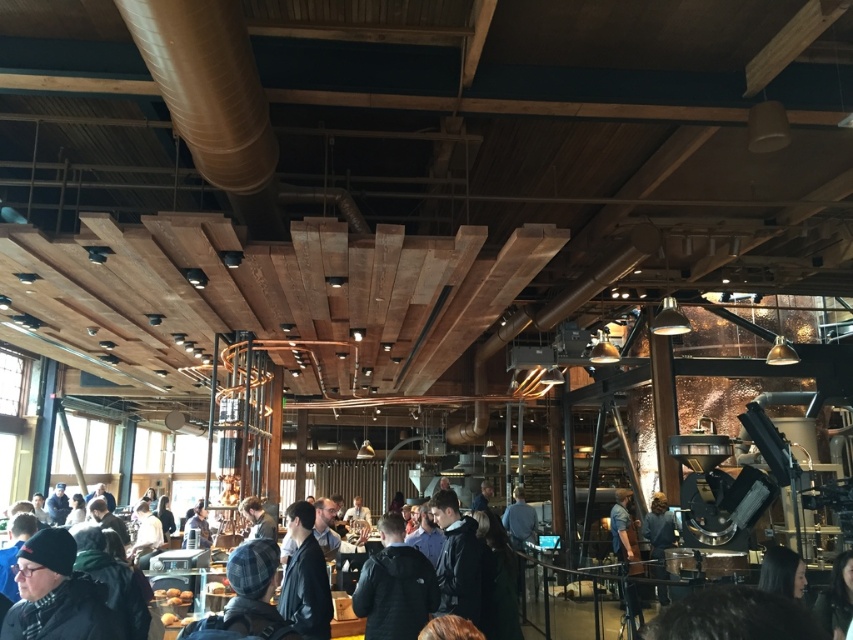
Image resolution: width=853 pixels, height=640 pixels. What do you see at coordinates (393, 586) in the screenshot?
I see `dark blue jacket at center` at bounding box center [393, 586].

How much distance is there between dark blue jacket at center and blue shirt at center?

dark blue jacket at center is 6.52 meters from blue shirt at center.

Based on the photo, who is more distant from viewer, (351, 602) or (627, 538)?

Point (627, 538)

Identify the location of dark blue jacket at center. (393, 586).

I want to click on smooth black hair at lower right, so click(x=782, y=572).

Is smooth black hair at lower right further to the viewer compared to blue shirt at center?

No, smooth black hair at lower right is closer to the viewer.

Who is more forward, (785, 570) or (630, 584)?

Positioned in front is point (785, 570).

Identify the location of smooth black hair at lower right. This screenshot has height=640, width=853. (782, 572).

Can you confirm if dark blue jacket at center is shorter than smooth black hair at lower right?

Incorrect, dark blue jacket at center's height does not fall short of smooth black hair at lower right's.

Can you confirm if dark blue jacket at center is bigger than smooth black hair at lower right?

Indeed, dark blue jacket at center has a larger size compared to smooth black hair at lower right.

Is point (368, 600) less distant than point (801, 563)?

No, it is not.

Identify the location of dark blue jacket at center. The height and width of the screenshot is (640, 853). (393, 586).